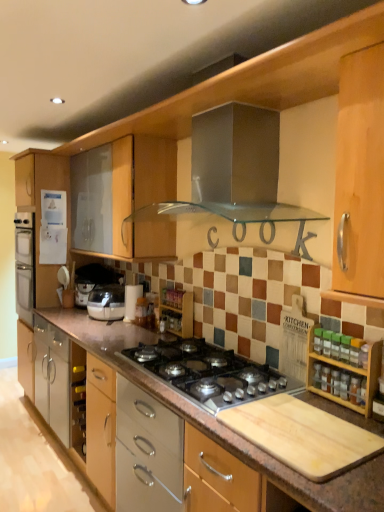
Question: Considering the positions of matte white blender at center and satin silver toaster at lower left, placed as the second appliance when sorted from back to front, in the image, is matte white blender at center wider or thinner than satin silver toaster at lower left, placed as the second appliance when sorted from back to front,?

Choices:
 (A) wide
 (B) thin

Answer: (A)

Question: From a real-world perspective, is matte white blender at center physically located above or below satin silver toaster at lower left, arranged as the 2th appliance when viewed from the front?

Choices:
 (A) below
 (B) above

Answer: (A)

Question: Which is farther from the wooden spice rack at right, marked as the first cabinetry in a right-to-left arrangement?

Choices:
 (A) satin silver gas stove at center
 (B) matte silver cabinet at lower center, the second cabinetry viewed from the right
 (C) white paper refrigerator at left, acting as the first appliance starting from the left
 (D) wooden spice rack at center
 (E) matte white blender at center

Answer: (C)

Question: Which is nearer to the satin silver toaster at lower left, the 2th appliance in the bottom-to-top sequence?

Choices:
 (A) white paper refrigerator at left, the 3th appliance from the right
 (B) white paper towel holder at center, the first appliance when ordered from right to left
 (C) wooden spice rack at center
 (D) wooden spice rack at right, marked as the first cabinetry in a right-to-left arrangement
 (E) matte silver cabinet at lower center, which is the 1th cabinetry in back-to-front order

Answer: (A)